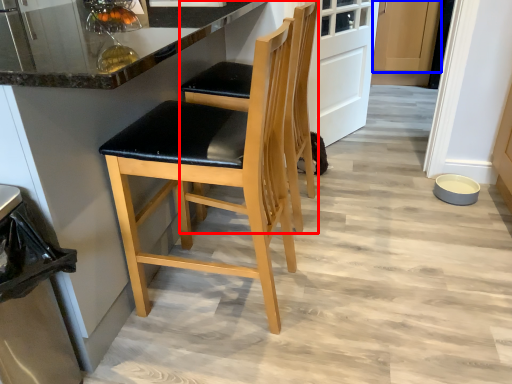
Question: Which object appears farthest to the camera in this image, chair (highlighted by a red box) or cabinetry (highlighted by a blue box)?

Choices:
 (A) chair
 (B) cabinetry

Answer: (B)